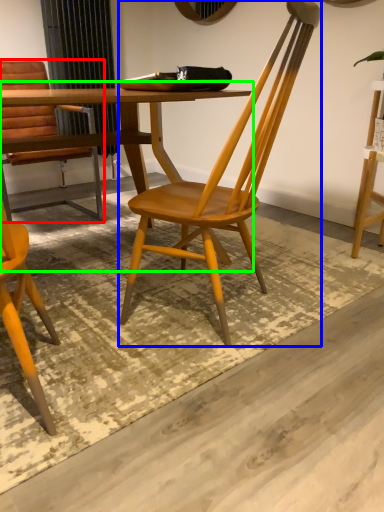
Question: Which is farther away from chair (highlighted by a red box)? chair (highlighted by a blue box) or table (highlighted by a green box)?

Choices:
 (A) chair
 (B) table

Answer: (A)